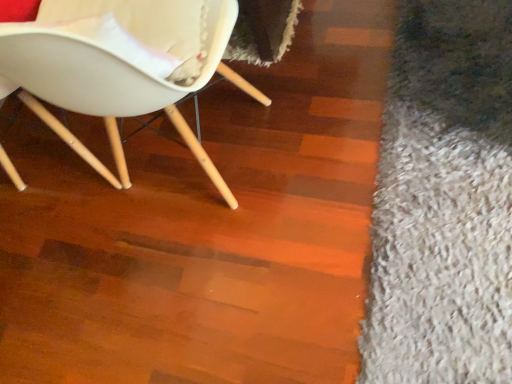
The image size is (512, 384). In order to click on free space to the left of white matte plastic chair at upper left in this screenshot , I will do `click(88, 262)`.